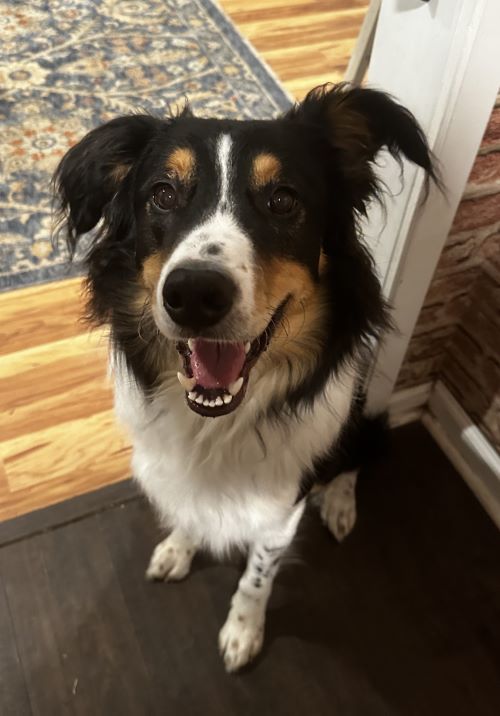
The height and width of the screenshot is (716, 500). I want to click on rug, so click(51, 48).